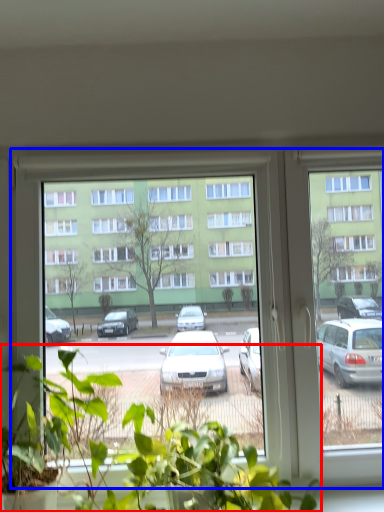
Question: Which point is further to the camera, houseplant (highlighted by a red box) or window (highlighted by a blue box)?

Choices:
 (A) houseplant
 (B) window

Answer: (B)